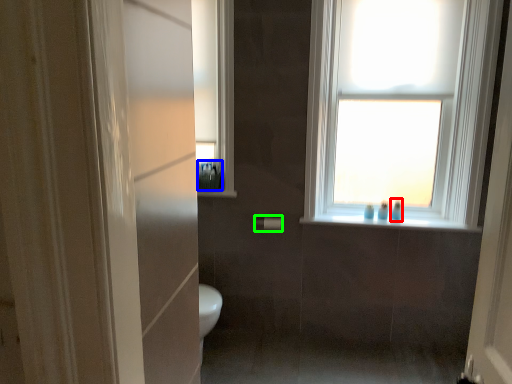
Question: Based on their relative distances, which object is farther from toiletry (highlighted by a red box)? Choose from toiletry (highlighted by a blue box) and towel bar (highlighted by a green box).

Choices:
 (A) toiletry
 (B) towel bar

Answer: (A)